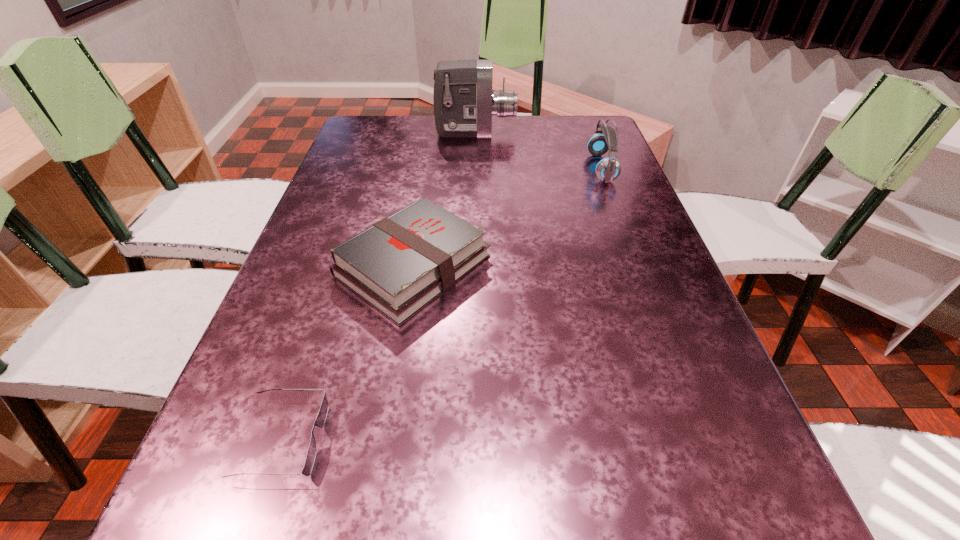
This screenshot has height=540, width=960. Identify the location of blank space located on the ear cups of the rightmost object. (564, 168).

You are a GUI agent. You are given a task and a screenshot of the screen. Output one action in this format:
    pyautogui.click(x=<x>, y=<y>)
    Task: Click on the vacant space situated 0.280m on the ear cups of the rightmost object
    This screenshot has width=960, height=540.
    Given the screenshot: What is the action you would take?
    pyautogui.click(x=492, y=168)

You are a GUI agent. You are given a task and a screenshot of the screen. Output one action in this format:
    pyautogui.click(x=<x>, y=<y>)
    Task: Click on the vacant space located 0.100m on the left of the third farthest object
    
    Given the screenshot: What is the action you would take?
    (x=290, y=266)

You are a GUI agent. You are given a task and a screenshot of the screen. Output one action in this format:
    pyautogui.click(x=<x>, y=<y>)
    Task: Click on the free space located 0.300m on the front-facing side of the shortest object
    
    Given the screenshot: What is the action you would take?
    pyautogui.click(x=516, y=439)

Locate an element on the screen. The image size is (960, 540). object that is at the far edge is located at coordinates (464, 103).

Image resolution: width=960 pixels, height=540 pixels. What are the coordinates of `hardback book present at the left edge` in the screenshot? It's located at (400, 264).

The image size is (960, 540). Find the location of `sunglasses located in the left edge section of the desktop`. sunglasses located in the left edge section of the desktop is located at coordinates (322, 415).

At what (x,y) coordinates should I click in order to perform the action: click on object that is at the right edge. Please return your answer as a coordinate pair (x, y). The image size is (960, 540). Looking at the image, I should click on (608, 169).

Find the location of a particular element. vacant area at the far edge of the desktop is located at coordinates (531, 130).

At what (x,y) coordinates should I click in order to perform the action: click on vacant space at the near edge of the desktop. Please return your answer as a coordinate pair (x, y). The width and height of the screenshot is (960, 540). Looking at the image, I should click on (568, 538).